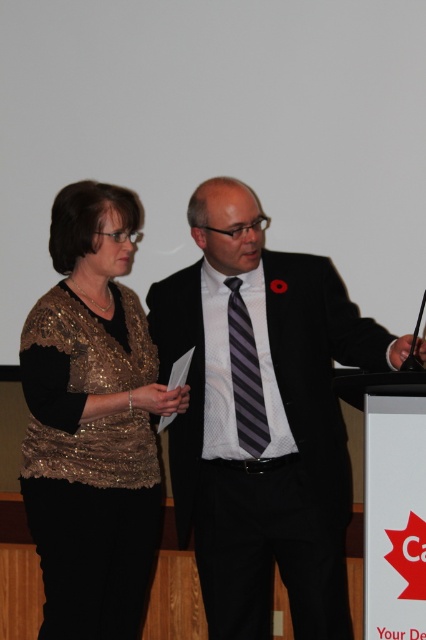
Which is above, gold sequined vest at left or striped fabric tie at center?

striped fabric tie at center is above.

You are a GUI agent. You are given a task and a screenshot of the screen. Output one action in this format:
    pyautogui.click(x=<x>, y=<y>)
    Task: Click on the gold sequined vest at left
    
    Given the screenshot: What is the action you would take?
    pyautogui.click(x=92, y=422)

Can you confirm if black suit at center is positioned to the left of striped fabric tie at center?

In fact, black suit at center is to the right of striped fabric tie at center.

Is black suit at center behind striped fabric tie at center?

No, it is not.

Who is more distant from viewer, (308, 440) or (259, 428)?

Positioned behind is point (308, 440).

Where is `black suit at center`? This screenshot has width=426, height=640. black suit at center is located at coordinates (261, 417).

Is black suit at center thinner than gold sequined vest at left?

In fact, black suit at center might be wider than gold sequined vest at left.

Is black suit at center above gold sequined vest at left?

Yes, black suit at center is above gold sequined vest at left.

You are a GUI agent. You are given a task and a screenshot of the screen. Output one action in this format:
    pyautogui.click(x=<x>, y=<y>)
    Task: Click on the black suit at center
    The width and height of the screenshot is (426, 640).
    Given the screenshot: What is the action you would take?
    pyautogui.click(x=261, y=417)